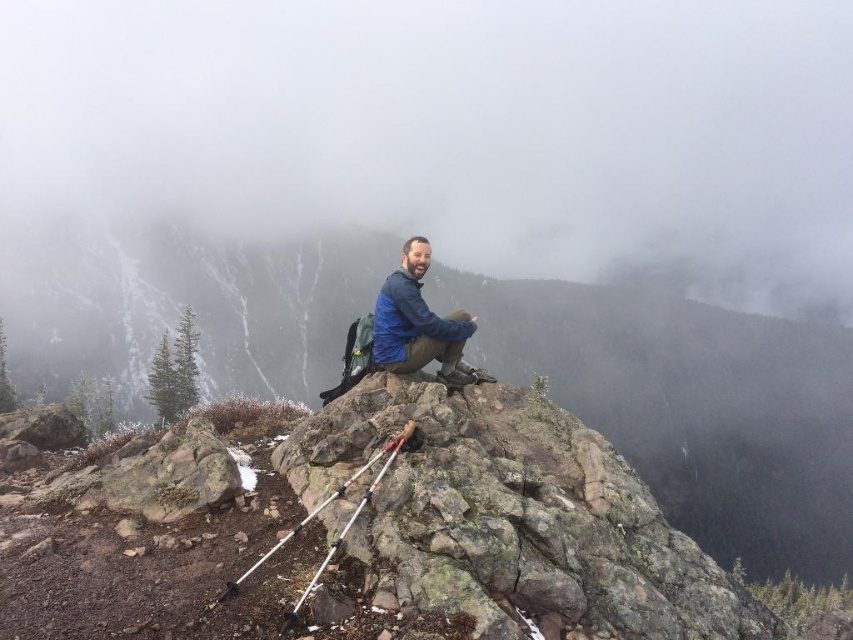
Question: Which object is positioned farthest from the rocky at center?

Choices:
 (A) white fog at upper center
 (B) blue softshell jacket at center

Answer: (B)

Question: Among these points, which one is nearest to the camera?

Choices:
 (A) (448, 355)
 (B) (9, 28)

Answer: (A)

Question: Is rocky at center thinner than blue softshell jacket at center?

Choices:
 (A) no
 (B) yes

Answer: (A)

Question: Does rocky at center appear on the right side of blue softshell jacket at center?

Choices:
 (A) no
 (B) yes

Answer: (B)

Question: Which object is farther from the camera taking this photo?

Choices:
 (A) rocky at center
 (B) blue softshell jacket at center
 (C) white fog at upper center

Answer: (C)

Question: Is white fog at upper center further to camera compared to blue softshell jacket at center?

Choices:
 (A) no
 (B) yes

Answer: (B)